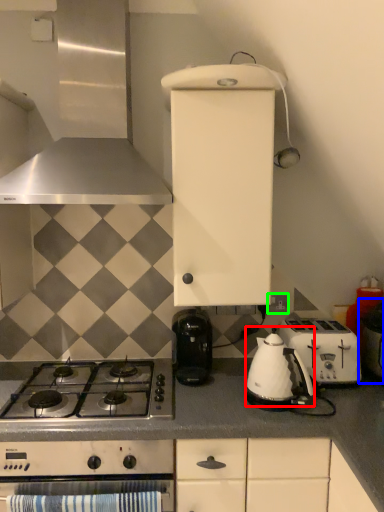
Question: Which is farther away from tea pot (highlighted by a red box)? appliance (highlighted by a blue box) or electric outlet (highlighted by a green box)?

Choices:
 (A) appliance
 (B) electric outlet

Answer: (B)